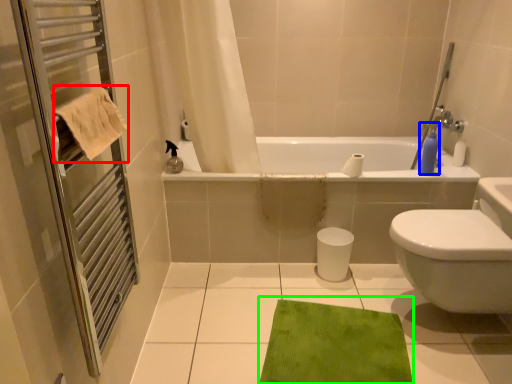
Question: Which object is the farthest from beach towel (highlighted by a red box)? Choose among these: soap dispenser (highlighted by a blue box) or bath mat (highlighted by a green box).

Choices:
 (A) soap dispenser
 (B) bath mat

Answer: (A)